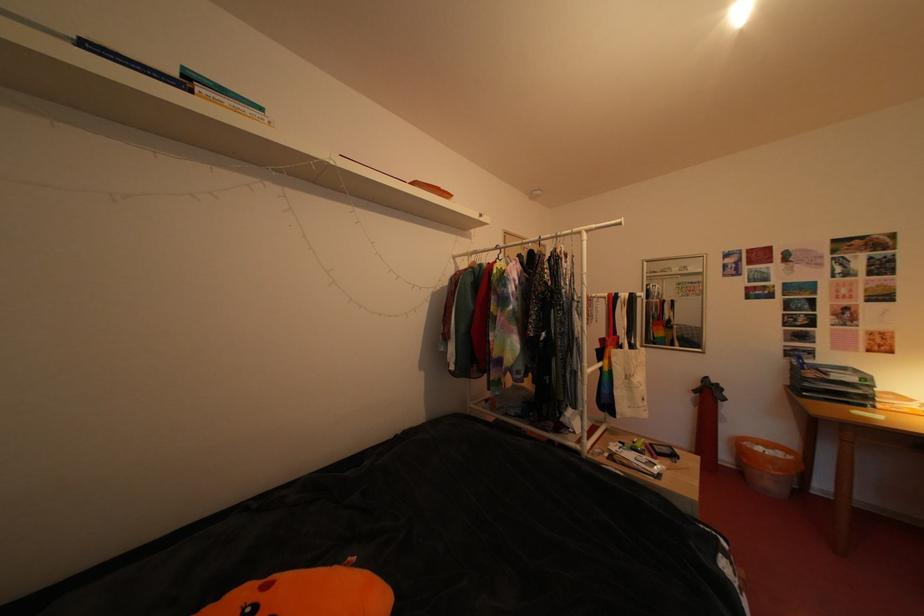
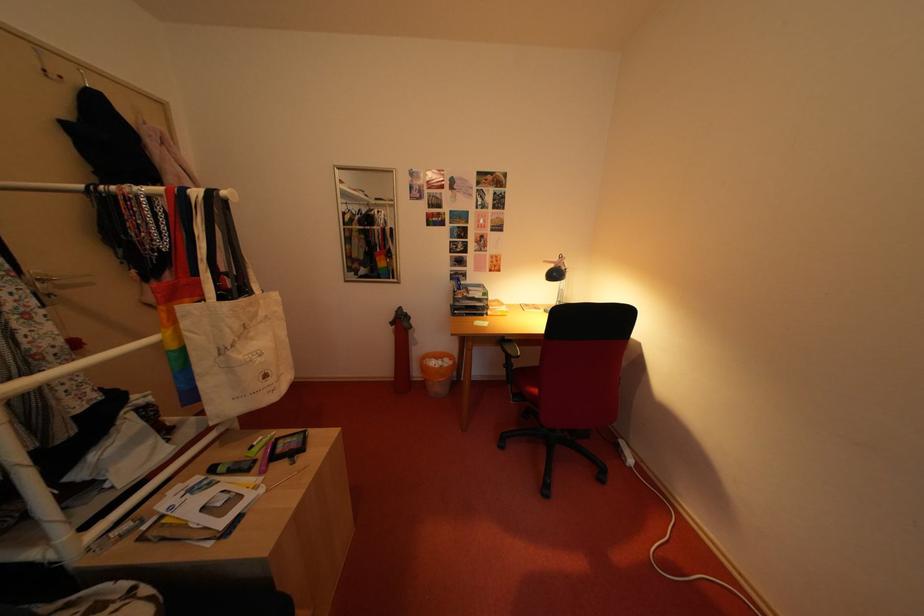
In the second image, find the point that corresponds to (x=735, y=463) in the first image.

(427, 379)